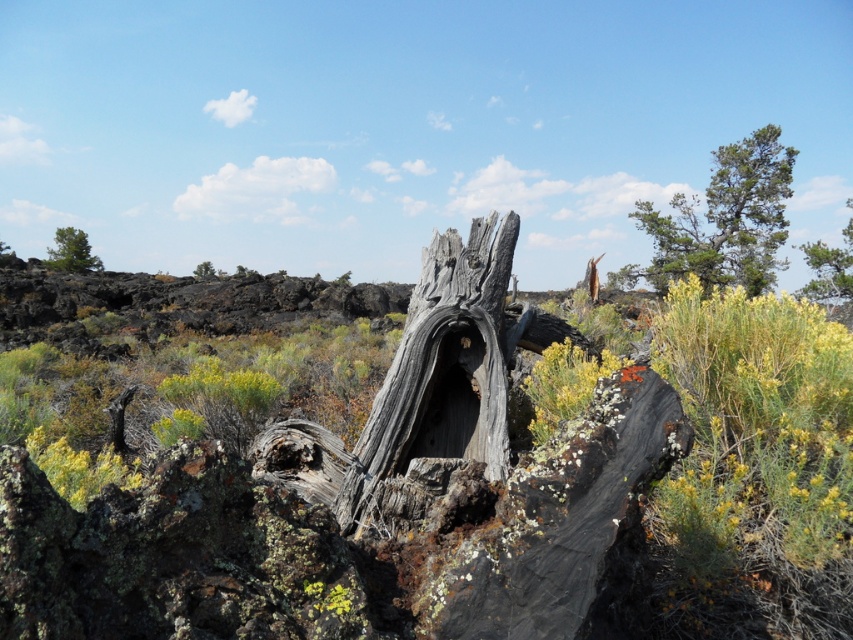
Question: Which object appears farthest from the camera in this image?

Choices:
 (A) gray rough bark tree at upper center
 (B) green rough bark tree at upper right

Answer: (A)

Question: Observing the image, what is the correct spatial positioning of gray weathered wood at center in reference to green rough bark tree at upper right?

Choices:
 (A) right
 (B) left

Answer: (B)

Question: Considering the relative positions of green rough bark tree at upper right and green rough bark tree at upper left in the image provided, where is green rough bark tree at upper right located with respect to green rough bark tree at upper left?

Choices:
 (A) right
 (B) left

Answer: (A)

Question: Is green rough bark tree at upper left closer to camera compared to yellow lichen at center?

Choices:
 (A) yes
 (B) no

Answer: (B)

Question: Which object is closer to the camera taking this photo?

Choices:
 (A) gray rough bark tree at upper center
 (B) green rough bark tree at upper left

Answer: (A)

Question: Considering the real-world distances, which object is farthest from the green leafy tree at upper right?

Choices:
 (A) gray rough bark tree at upper center
 (B) gray weathered wood at center
 (C) yellow lichen at center

Answer: (C)